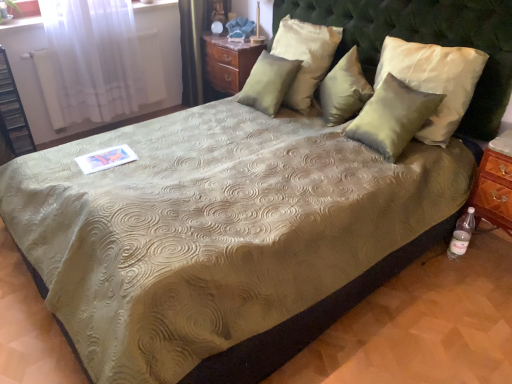
Question: Could you tell me if satin green pillow at upper right, which is counted as the 4th pillow, starting from the left, is turned towards wooden nightstand at upper center?

Choices:
 (A) no
 (B) yes

Answer: (A)

Question: Is the surface of satin green pillow at upper right, which ranks as the first pillow in right-to-left order, in direct contact with wooden nightstand at upper center?

Choices:
 (A) no
 (B) yes

Answer: (A)

Question: Does satin green pillow at upper right, which is counted as the 4th pillow, starting from the left, have a greater height compared to wooden nightstand at upper center?

Choices:
 (A) yes
 (B) no

Answer: (B)

Question: Is satin green pillow at upper right, which is counted as the 4th pillow, starting from the left, closer to camera compared to wooden nightstand at upper center?

Choices:
 (A) no
 (B) yes

Answer: (B)

Question: Does satin green pillow at upper right, which is counted as the 4th pillow, starting from the left, have a smaller size compared to wooden nightstand at upper center?

Choices:
 (A) yes
 (B) no

Answer: (A)

Question: Looking at their shapes, would you say satin white pillow at upper center, placed as the 3th pillow when sorted from right to left, is wider or thinner than wooden nightstand at upper center?

Choices:
 (A) wide
 (B) thin

Answer: (B)

Question: Considering the positions of point (304, 36) and point (236, 66), is point (304, 36) closer or farther from the camera than point (236, 66)?

Choices:
 (A) closer
 (B) farther

Answer: (A)

Question: In terms of height, does satin white pillow at upper center, which is the 2th pillow in left-to-right order, look taller or shorter compared to wooden nightstand at upper center?

Choices:
 (A) tall
 (B) short

Answer: (A)

Question: Considering the positions of satin white pillow at upper center, placed as the 3th pillow when sorted from right to left, and wooden nightstand at upper center in the image, is satin white pillow at upper center, placed as the 3th pillow when sorted from right to left, bigger or smaller than wooden nightstand at upper center?

Choices:
 (A) small
 (B) big

Answer: (A)

Question: From a real-world perspective, is clear plastic bottle at lower right positioned above or below green tufted headboard at upper center?

Choices:
 (A) above
 (B) below

Answer: (B)

Question: Visually, is clear plastic bottle at lower right positioned to the left or to the right of green tufted headboard at upper center?

Choices:
 (A) left
 (B) right

Answer: (B)

Question: Is point (471, 228) closer or farther from the camera than point (330, 6)?

Choices:
 (A) farther
 (B) closer

Answer: (B)

Question: Is clear plastic bottle at lower right in front of or behind green tufted headboard at upper center in the image?

Choices:
 (A) front
 (B) behind

Answer: (B)

Question: Considering the positions of point (430, 3) and point (296, 52), is point (430, 3) closer or farther from the camera than point (296, 52)?

Choices:
 (A) farther
 (B) closer

Answer: (B)

Question: Based on their sizes in the image, would you say green tufted headboard at upper center is bigger or smaller than satin white pillow at upper center, placed as the 3th pillow when sorted from right to left?

Choices:
 (A) small
 (B) big

Answer: (B)